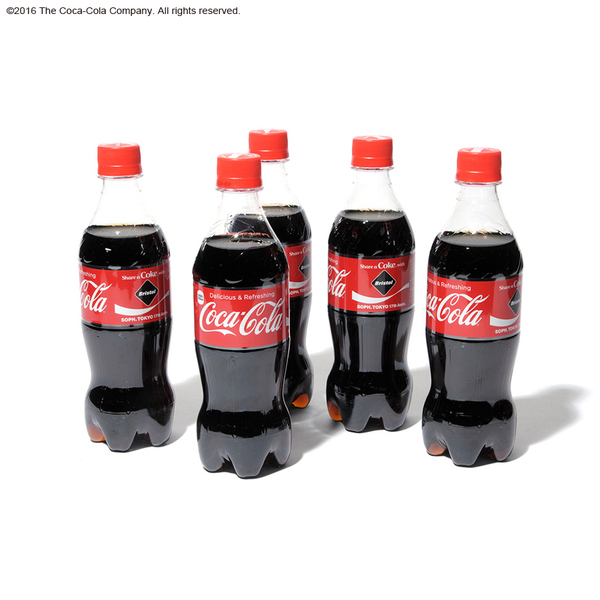
This screenshot has width=600, height=600. What are the coordinates of `bottles of coke` in the screenshot? It's located at (471, 298), (390, 271), (293, 229), (254, 273), (131, 285).